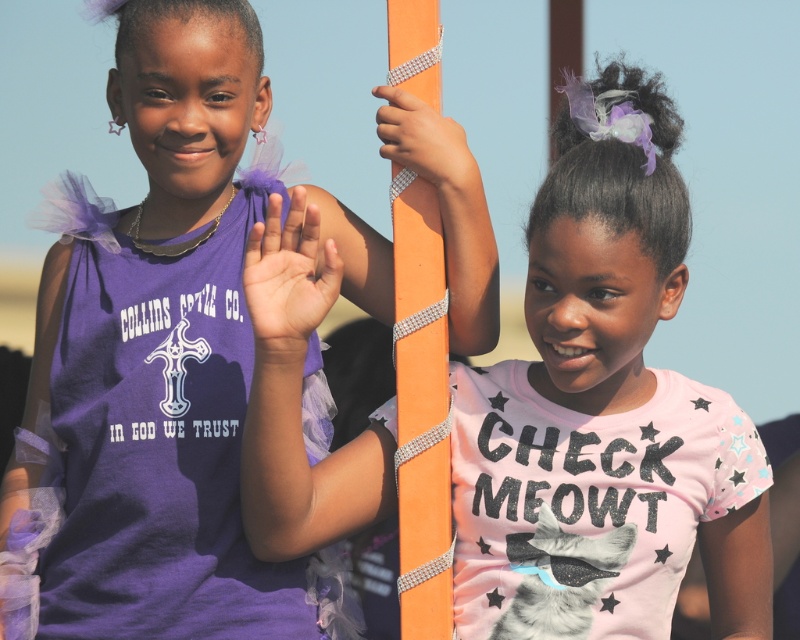
Question: Among these points, which one is nearest to the camera?

Choices:
 (A) (156, 81)
 (B) (412, 157)

Answer: (A)

Question: Can you confirm if orange sparkly pole at center is wider than matte purple hand at center?

Choices:
 (A) no
 (B) yes

Answer: (A)

Question: Can you confirm if pink glittery shirt at center is wider than orange shiny pole at center?

Choices:
 (A) no
 (B) yes

Answer: (B)

Question: Which of these objects is positioned closest to the orange shiny pole at center?

Choices:
 (A) matte purple hand at center
 (B) purple tulle dress at left
 (C) orange sparkly pole at center

Answer: (C)

Question: Which of the following is the farthest from the observer?

Choices:
 (A) (392, 38)
 (B) (432, 172)

Answer: (B)

Question: Is purple tulle dress at left bigger than matte purple hand at center?

Choices:
 (A) no
 (B) yes

Answer: (B)